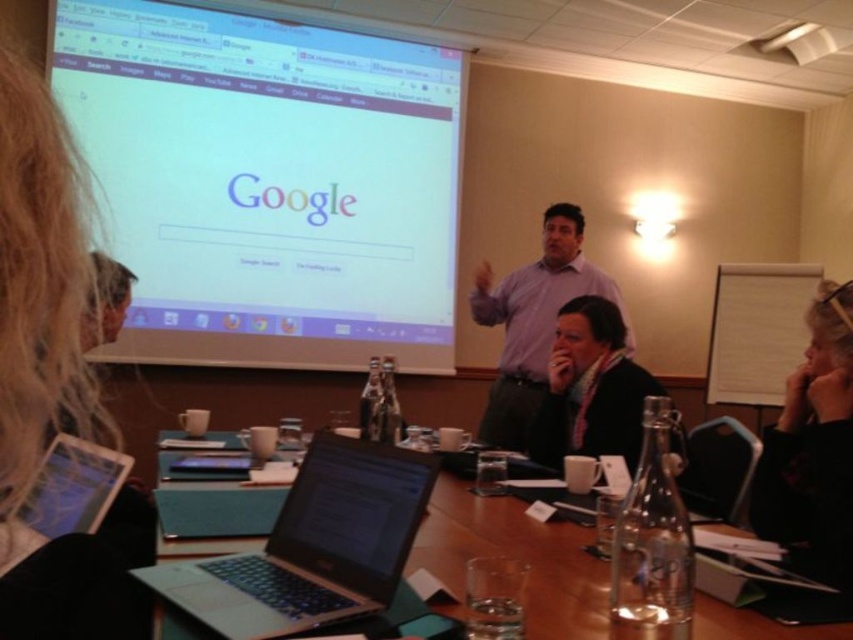
Question: Estimate the real-world distances between objects in this image. Which object is closer to the black fabric hair at upper right?

Choices:
 (A) matte plastic projector screen at upper left
 (B) purple shirt at center

Answer: (B)

Question: Is matte plastic projector screen at upper left closer to camera compared to purple shirt at center?

Choices:
 (A) yes
 (B) no

Answer: (B)

Question: Which point is farther to the camera?

Choices:
 (A) (189, 592)
 (B) (126, 122)

Answer: (B)

Question: Based on their relative distances, which object is farther from the silver metallic laptop at center?

Choices:
 (A) dark gray sweater at lower center
 (B) purple shirt at center

Answer: (B)

Question: Is metallic silver laptop at center further to camera compared to dark gray sweater at lower center?

Choices:
 (A) no
 (B) yes

Answer: (A)

Question: In this image, where is silver metallic laptop at center located relative to dark gray sweater at lower center?

Choices:
 (A) right
 (B) left

Answer: (B)